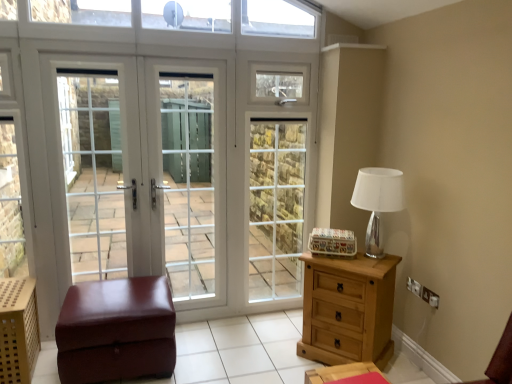
What do you see at coordinates (116, 331) in the screenshot? I see `brown leather ottoman at lower left` at bounding box center [116, 331].

Measure the distance between point (x=62, y=321) and camera.

A distance of 7.46 feet exists between point (x=62, y=321) and camera.

In order to click on white glass screen door at left, the third screen door from the right in this screenshot , I will do `click(93, 172)`.

Locate an element on the screen. Image resolution: width=512 pixels, height=384 pixels. light brown wooden chest of drawers at right is located at coordinates (348, 309).

Locate an element on the screen. silver metallic table lamp at right is located at coordinates tap(377, 201).

You are a GUI agent. You are given a task and a screenshot of the screen. Output one action in this format:
    pyautogui.click(x=<x>, y=<y>)
    Task: Click on the white glass door at center, which appears as the 3th screen door when viewed from the left
    
    Given the screenshot: What is the action you would take?
    pyautogui.click(x=276, y=207)

Where is `wooden nightstand at lower right`? This screenshot has width=512, height=384. wooden nightstand at lower right is located at coordinates (346, 374).

Which object is positioned more to the right, white glass screen door at left, arranged as the first screen door when viewed from the left, or wooden nightstand at lower right?

Positioned to the right is wooden nightstand at lower right.

From the image's perspective, which is below, white glass screen door at left, arranged as the first screen door when viewed from the left, or wooden nightstand at lower right?

wooden nightstand at lower right, from the image's perspective.

Does point (112, 243) lie in front of point (369, 363)?

No, it is not.

From their relative heights in the image, would you say white glass door at center is taller or shorter than wooden perforated crate at lower left?

white glass door at center is taller than wooden perforated crate at lower left.

From a real-world perspective, is white glass door at center over wooden perforated crate at lower left?

Correct, in the physical world, white glass door at center is higher than wooden perforated crate at lower left.

Does white glass door at center have a lesser width compared to wooden perforated crate at lower left?

Yes.

Based on their positions, is white glass screen door at left, the third screen door from the right, located to the left or right of white glass door at center?

white glass screen door at left, the third screen door from the right, is to the left of white glass door at center.

Considering the sizes of objects white glass screen door at left, arranged as the first screen door when viewed from the left, and white glass door at center in the image provided, who is smaller, white glass screen door at left, arranged as the first screen door when viewed from the left, or white glass door at center?

With smaller size is white glass screen door at left, arranged as the first screen door when viewed from the left.

Is white glass screen door at left, arranged as the first screen door when viewed from the left, next to white glass door at center and touching it?

No, white glass screen door at left, arranged as the first screen door when viewed from the left, is not in contact with white glass door at center.

From a real-world perspective, is white glass screen door at left, arranged as the first screen door when viewed from the left, on top of white glass door at center?

Yes, from a real-world perspective, white glass screen door at left, arranged as the first screen door when viewed from the left, is above white glass door at center.

Is wooden nightstand at lower right directly adjacent to brown leather ottoman at lower left?

No, wooden nightstand at lower right is not beside brown leather ottoman at lower left.

Which is behind, wooden nightstand at lower right or brown leather ottoman at lower left?

brown leather ottoman at lower left is behind.

From a real-world perspective, which object rests below the other?

From a 3D spatial view, brown leather ottoman at lower left is below.

Is light brown wooden chest of drawers at right a part of wooden perforated crate at lower left?

Definitely not — light brown wooden chest of drawers at right is not inside wooden perforated crate at lower left.

Is the position of wooden perforated crate at lower left less distant than that of light brown wooden chest of drawers at right?

Yes, it is.

Considering the positions of point (19, 355) and point (354, 288), is point (19, 355) closer or farther from the camera than point (354, 288)?

Point (19, 355).

Is white glass screen door at center, placed as the second screen door when sorted from left to right, inside white glass screen door at left, the third screen door from the right?

No, white glass screen door at center, placed as the second screen door when sorted from left to right, is not surrounded by white glass screen door at left, the third screen door from the right.

Can you tell me how much white glass screen door at left, arranged as the first screen door when viewed from the left, and white glass screen door at center, placed as the second screen door when sorted from left to right, differ in facing direction?

The facing directions of white glass screen door at left, arranged as the first screen door when viewed from the left, and white glass screen door at center, placed as the second screen door when sorted from left to right, are 0.0069 degrees apart.

Which object is closer to the camera taking this photo, white glass screen door at left, arranged as the first screen door when viewed from the left, or white glass screen door at center, acting as the 2th screen door starting from the right?

white glass screen door at left, arranged as the first screen door when viewed from the left, is closer to the camera.

From a real-world perspective, is brown leather ottoman at lower left on light brown wooden chest of drawers at right?

No, from a real-world perspective, brown leather ottoman at lower left is not on top of light brown wooden chest of drawers at right.

Can you confirm if brown leather ottoman at lower left is smaller than light brown wooden chest of drawers at right?

Actually, brown leather ottoman at lower left might be larger than light brown wooden chest of drawers at right.

Does brown leather ottoman at lower left turn towards light brown wooden chest of drawers at right?

No, brown leather ottoman at lower left is not oriented towards light brown wooden chest of drawers at right.

From the image's perspective, is brown leather ottoman at lower left above or below light brown wooden chest of drawers at right?

Based on their image positions, brown leather ottoman at lower left is located beneath light brown wooden chest of drawers at right.

Image resolution: width=512 pixels, height=384 pixels. I want to click on the 3rd screen door positioned above the wooden nightstand at lower right (from the image's perspective), so click(x=93, y=172).

Identify the location of crate lying below the white glass door at center (from the image's perspective). The height and width of the screenshot is (384, 512). (18, 330).

From the picture: Estimate the real-world distances between objects in this image. Which object is closer to white glass screen door at left, the third screen door from the right, wooden nightstand at lower right or white glass door at center?

The object closer to white glass screen door at left, the third screen door from the right, is white glass door at center.

Estimate the real-world distances between objects in this image. Which object is further from white glass door at center, placed as the 1th screen door when sorted from right to left, silver metallic table lamp at right or brown leather ottoman at lower left?

silver metallic table lamp at right lies further to white glass door at center, placed as the 1th screen door when sorted from right to left, than the other object.

Looking at the image, which one is located further to light brown wooden chest of drawers at right, silver metallic table lamp at right or wooden nightstand at lower right?

wooden nightstand at lower right is further to light brown wooden chest of drawers at right.

Which object lies further to the anchor point wooden nightstand at lower right, white glass door at center or silver metallic table lamp at right?

white glass door at center is positioned further to the anchor wooden nightstand at lower right.

Looking at this image, based on their spatial positions, is silver metallic table lamp at right or white glass door at center, which appears as the 3th screen door when viewed from the left, closer to wooden perforated crate at lower left?

The object closer to wooden perforated crate at lower left is silver metallic table lamp at right.

Looking at the image, which one is located further to light brown wooden chest of drawers at right, wooden nightstand at lower right or brown leather ottoman at lower left?

brown leather ottoman at lower left.

Which object lies nearer to the anchor point wooden nightstand at lower right, brown leather ottoman at lower left or wooden perforated crate at lower left?

Based on the image, brown leather ottoman at lower left appears to be nearer to wooden nightstand at lower right.

Estimate the real-world distances between objects in this image. Which object is closer to silver metallic table lamp at right, brown leather ottoman at lower left or light brown wooden chest of drawers at right?

light brown wooden chest of drawers at right is positioned closer to the anchor silver metallic table lamp at right.

The image size is (512, 384). I want to click on table lamp between wooden nightstand at lower right and white glass door at center, which appears as the 3th screen door when viewed from the left, from front to back, so click(x=377, y=201).

This screenshot has width=512, height=384. In order to click on chest of drawers between white glass screen door at left, arranged as the first screen door when viewed from the left, and silver metallic table lamp at right in this screenshot , I will do (x=348, y=309).

This screenshot has height=384, width=512. Find the location of `furniture between wooden perforated crate at lower left and white glass screen door at center, acting as the 2th screen door starting from the right, from left to right`. furniture between wooden perforated crate at lower left and white glass screen door at center, acting as the 2th screen door starting from the right, from left to right is located at coordinates (116, 331).

The height and width of the screenshot is (384, 512). What are the coordinates of `table lamp between white glass door at center, which appears as the 3th screen door when viewed from the left, and light brown wooden chest of drawers at right from top to bottom` in the screenshot? It's located at (377, 201).